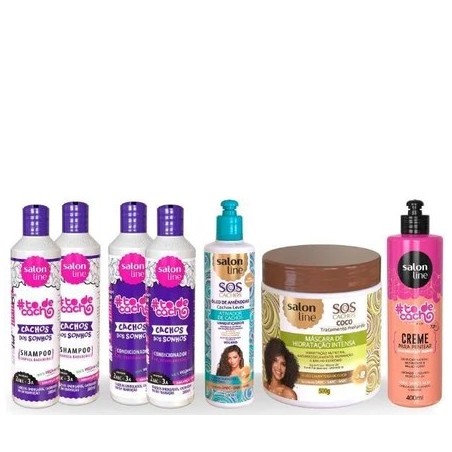
Identify the location of bottle. This screenshot has height=452, width=452. (36, 334), (74, 335), (131, 342), (168, 347), (226, 348), (396, 343).